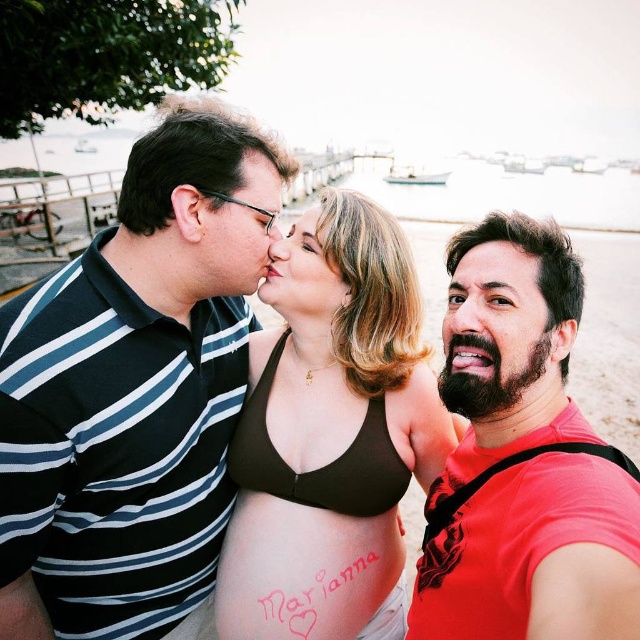
Find the location of a particular element. This screenshot has width=640, height=640. black matte bikini top at center is located at coordinates (321, 467).

In the scene shown: Is black matte bikini top at center smaller than smooth skin nose at center?

Actually, black matte bikini top at center might be larger than smooth skin nose at center.

Find the location of `black matte bikini top at center`. black matte bikini top at center is located at coordinates (321, 467).

Who is lower down, red matte t-shirt at center or black matte bikini top at center?

Positioned lower is black matte bikini top at center.

Is red matte t-shirt at center behind black matte bikini top at center?

No, it is not.

Between point (625, 545) and point (371, 451), which one is positioned in front?

Point (625, 545)

At what (x,y) coordinates should I click in order to perform the action: click on red matte t-shirt at center. Please return your answer as a coordinate pair (x, y). This screenshot has height=640, width=640. Looking at the image, I should click on (524, 465).

Between striped cotton polo shirt at left and bearded man at right, which one has more height?

With more height is striped cotton polo shirt at left.

Who is lower down, striped cotton polo shirt at left or bearded man at right?

striped cotton polo shirt at left is below.

Who is more distant from viewer, (198,177) or (452,348)?

Positioned behind is point (198,177).

At what (x,y) coordinates should I click in order to perform the action: click on striped cotton polo shirt at left. Please return your answer as a coordinate pair (x, y). Looking at the image, I should click on (134, 388).